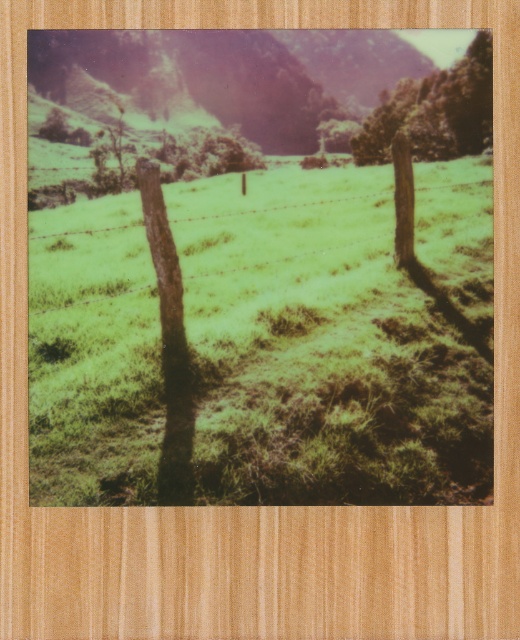
Between green grassy at center and green leafy tree at upper center, which one is positioned lower?

Positioned lower is green grassy at center.

Consider the image. Is green grassy at center wider than green leafy tree at upper center?

No, green grassy at center is not wider than green leafy tree at upper center.

The height and width of the screenshot is (640, 520). In order to click on green grassy at center in this screenshot , I will do `click(321, 349)`.

Where is `green grassy at center`? green grassy at center is located at coordinates (321, 349).